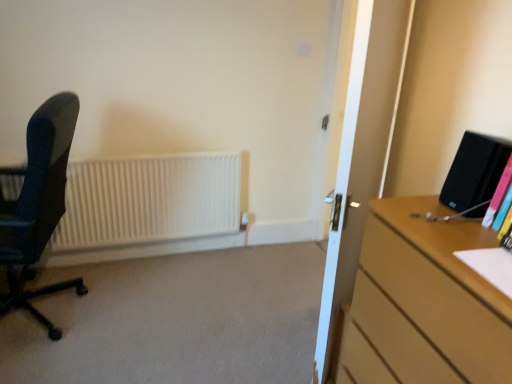
This screenshot has height=384, width=512. In order to click on vacant space to the left of transparent glass door at center in this screenshot , I will do `click(257, 331)`.